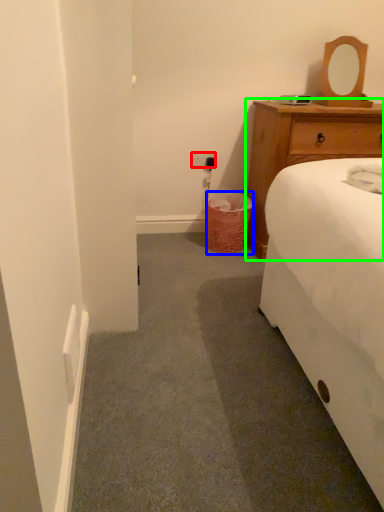
Question: Which object is positioned closest to power outlet (highlighted by a red box)? Select from trash bin/can (highlighted by a blue box) and chest of drawers (highlighted by a green box).

Choices:
 (A) trash bin/can
 (B) chest of drawers

Answer: (A)